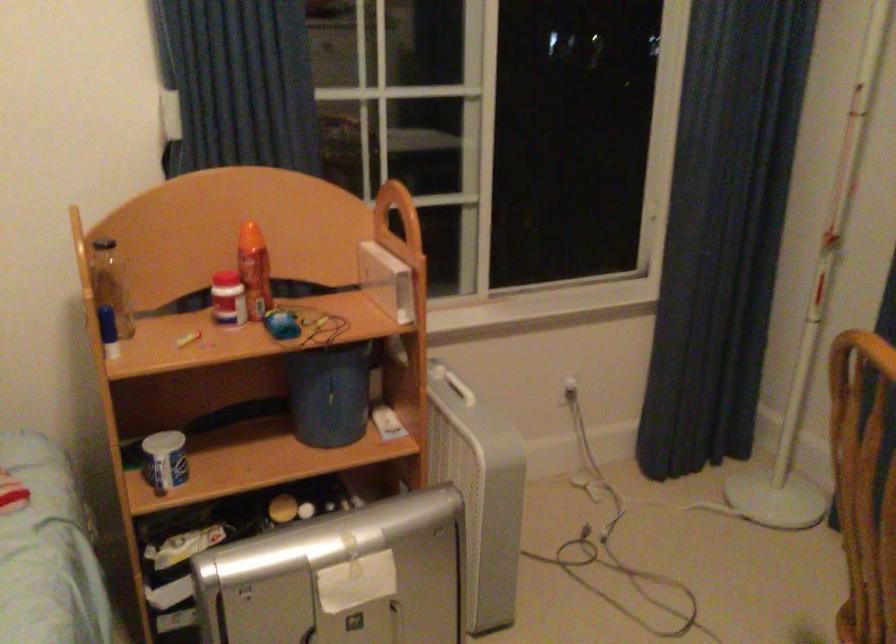
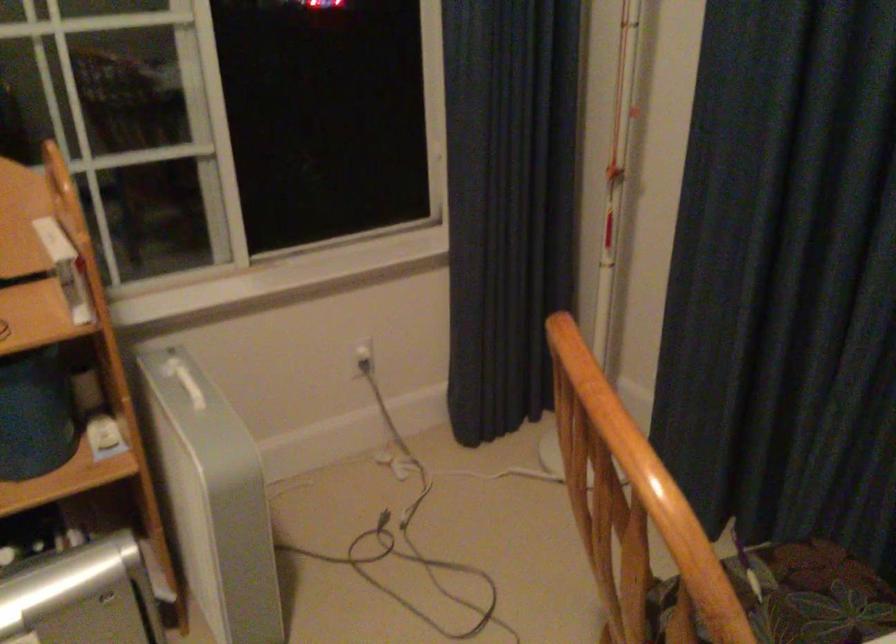
Where in the second image is the point corresponding to (x=574, y=383) from the first image?

(363, 355)